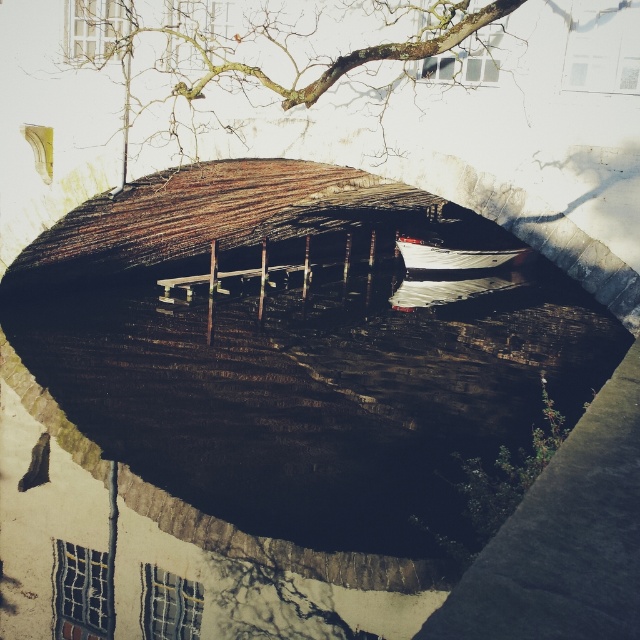
Does bare branches at upper center appear over white glossy boat at center?

Correct, bare branches at upper center is located above white glossy boat at center.

Does bare branches at upper center appear on the right side of white glossy boat at center?

In fact, bare branches at upper center is to the left of white glossy boat at center.

In order to click on bare branches at upper center in this screenshot , I will do `click(278, 49)`.